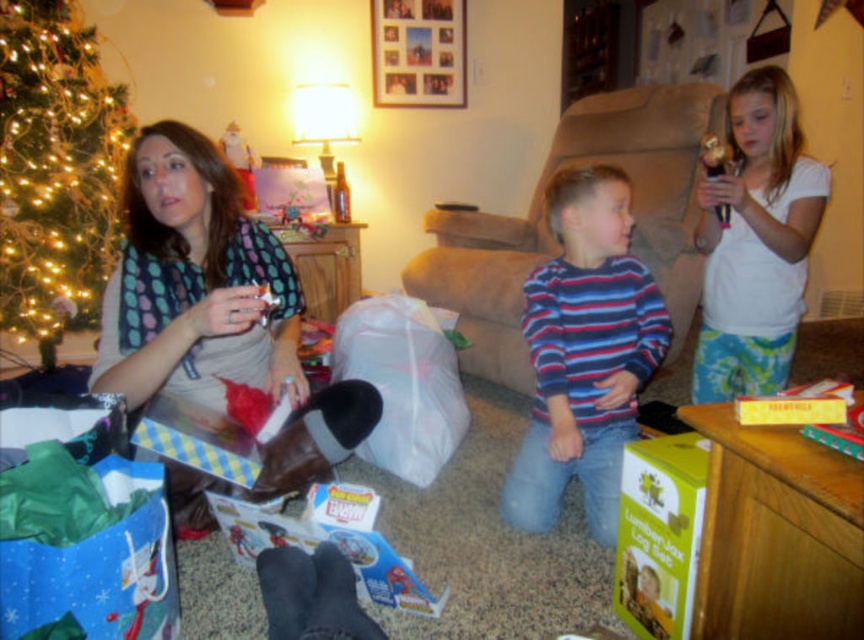
Question: Can you confirm if green matte christmas tree at left is thinner than white cotton shirt at upper right?

Choices:
 (A) yes
 (B) no

Answer: (B)

Question: Is green matte christmas tree at left wider than white cotton shirt at upper right?

Choices:
 (A) yes
 (B) no

Answer: (A)

Question: Which object is farther from the camera taking this photo?

Choices:
 (A) striped cotton shirt at center
 (B) green matte christmas tree at left
 (C) polka dot fabric shirt at left

Answer: (B)

Question: Does green matte christmas tree at left have a larger size compared to white cotton shirt at upper right?

Choices:
 (A) no
 (B) yes

Answer: (B)

Question: Which point is farther to the camera?

Choices:
 (A) green matte christmas tree at left
 (B) striped cotton shirt at center

Answer: (A)

Question: Which of the following is the closest to the observer?

Choices:
 (A) (64, 192)
 (B) (163, 228)
 (C) (759, 141)
 (D) (617, 337)

Answer: (B)